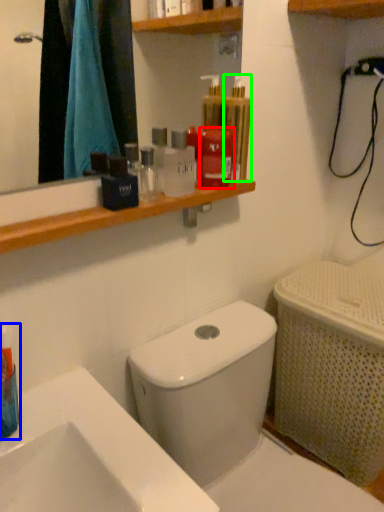
Question: Which is nearer to the mouthwash (highlighted by a red box)? mouthwash (highlighted by a blue box) or mouthwash (highlighted by a green box).

Choices:
 (A) mouthwash
 (B) mouthwash

Answer: (B)